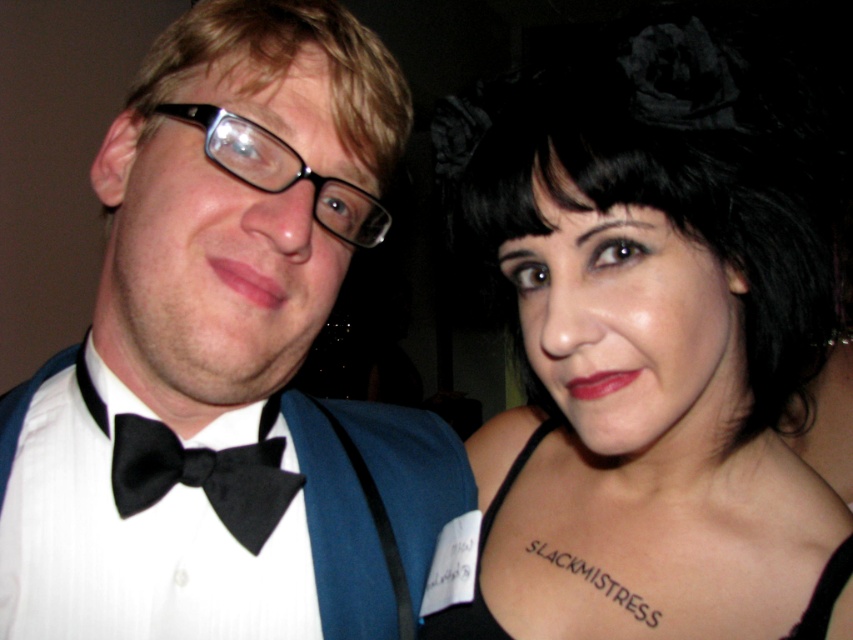
Does white satin bow tie at center have a larger size compared to black plastic glasses at left?

Correct, white satin bow tie at center is larger in size than black plastic glasses at left.

This screenshot has width=853, height=640. Find the location of `white satin bow tie at center`. white satin bow tie at center is located at coordinates (225, 358).

Which is above, black matte hair at upper right or black satin bow tie at left?

Positioned higher is black matte hair at upper right.

Which is behind, point (614, 282) or point (234, 460)?

Positioned behind is point (234, 460).

Locate an element on the screen. The height and width of the screenshot is (640, 853). black matte hair at upper right is located at coordinates (651, 349).

Does white satin bow tie at center have a lesser height compared to black fabric dress at center?

No, white satin bow tie at center is not shorter than black fabric dress at center.

Which is more to the right, white satin bow tie at center or black fabric dress at center?

From the viewer's perspective, black fabric dress at center appears more on the right side.

Does point (335, 148) lie in front of point (815, 596)?

Yes, point (335, 148) is in front of point (815, 596).

I want to click on white satin bow tie at center, so click(225, 358).